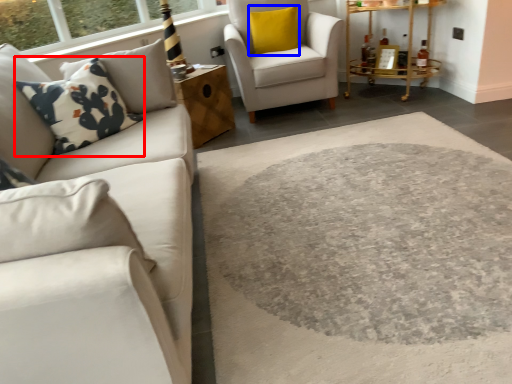
Question: Which point is closer to the camera, throw pillow (highlighted by a red box) or pillow (highlighted by a blue box)?

Choices:
 (A) throw pillow
 (B) pillow

Answer: (A)